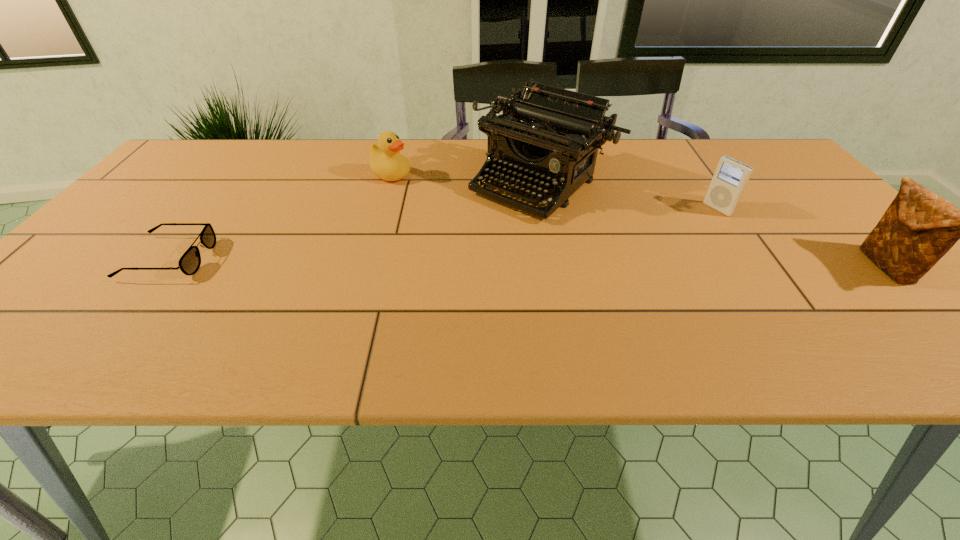
Identify the location of vacant point at the far left corner. (180, 176).

You are a GUI agent. You are given a task and a screenshot of the screen. Output one action in this format:
    pyautogui.click(x=<x>, y=<y>)
    Task: Click on the vacant space at the near left corner of the desktop
    
    Given the screenshot: What is the action you would take?
    pyautogui.click(x=47, y=308)

What are the coordinates of `vacant region at the far right corner of the desktop` in the screenshot? It's located at (758, 143).

I want to click on free space between the second object from left to right and the typewriter, so click(x=467, y=179).

Locate an element on the screen. The height and width of the screenshot is (540, 960). empty space that is in between the fourth object from left to right and the spectacles is located at coordinates (444, 234).

This screenshot has height=540, width=960. In order to click on vacant point located between the fourth object from right to left and the tallest object in this screenshot , I will do `click(467, 179)`.

Identify the location of vacant area that lies between the third object from left to right and the shortest object. (356, 220).

At what (x,y) coordinates should I click in order to perform the action: click on free space between the iPod and the third object from left to right. Please return your answer as a coordinate pair (x, y). Looking at the image, I should click on (630, 196).

Find the location of a particular element. The image size is (960, 540). blank region between the iPod and the shortest object is located at coordinates (444, 234).

Identify the location of vacant space that's between the clutch bag and the shortest object. This screenshot has width=960, height=540. (528, 262).